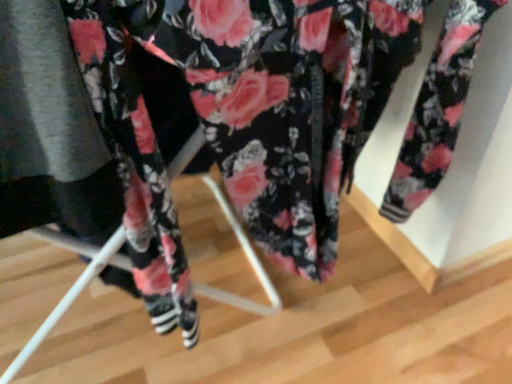
The image size is (512, 384). Describe the element at coordinates (260, 97) in the screenshot. I see `floral fabric pants at center` at that location.

The width and height of the screenshot is (512, 384). I want to click on floral fabric pants at center, so click(260, 97).

Where is `floral fabric pants at center`? This screenshot has height=384, width=512. floral fabric pants at center is located at coordinates (260, 97).